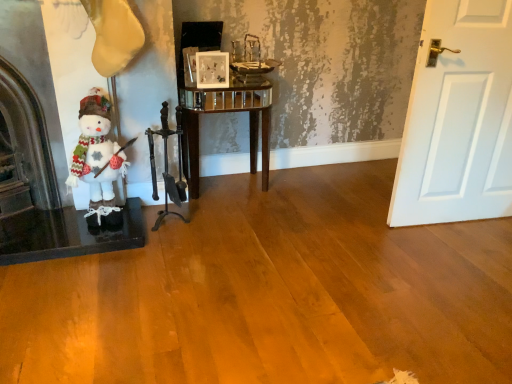
Locate an element on the screen. The width and height of the screenshot is (512, 384). free space below glossy wood side table at center (from a real-world perspective) is located at coordinates (226, 190).